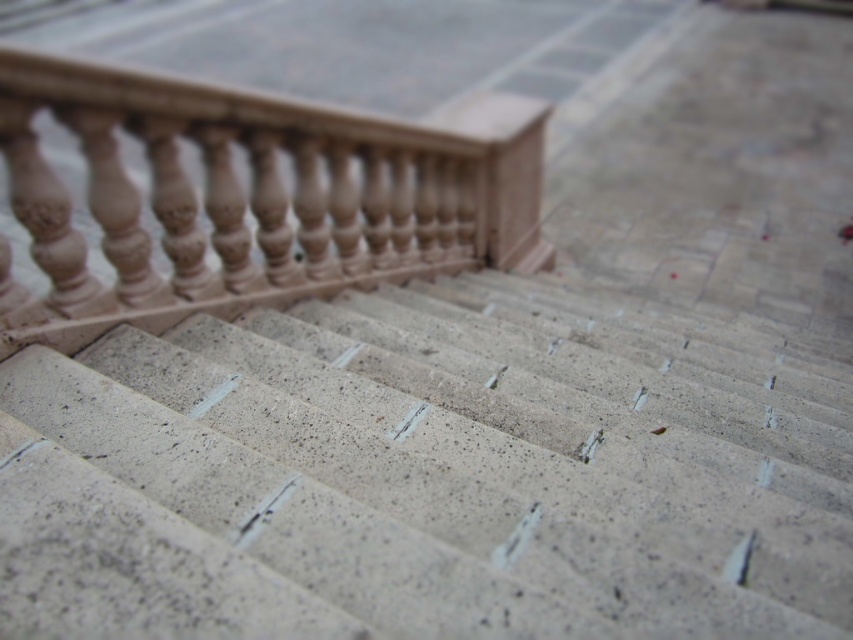
Question: Can you confirm if granite stairs at center is positioned below sandy beige stone balustrade at upper left?

Choices:
 (A) no
 (B) yes

Answer: (B)

Question: Is granite stairs at center closer to camera compared to sandy beige stone balustrade at upper left?

Choices:
 (A) yes
 (B) no

Answer: (A)

Question: Can you confirm if granite stairs at center is positioned above sandy beige stone balustrade at upper left?

Choices:
 (A) yes
 (B) no

Answer: (B)